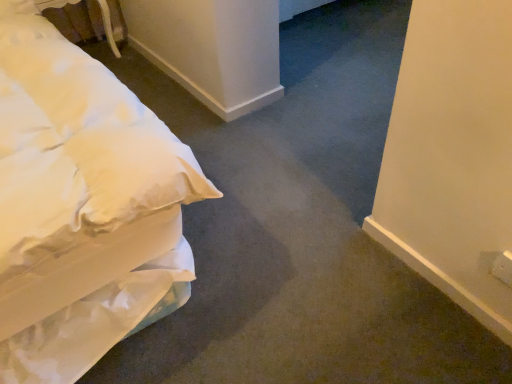
Question: Can you confirm if white fabric bed at upper left is shorter than white soft bed at left?

Choices:
 (A) yes
 (B) no

Answer: (A)

Question: Does white fabric bed at upper left turn towards white soft bed at left?

Choices:
 (A) no
 (B) yes

Answer: (A)

Question: Can you confirm if white fabric bed at upper left is taller than white soft bed at left?

Choices:
 (A) yes
 (B) no

Answer: (B)

Question: Is white fabric bed at upper left smaller than white soft bed at left?

Choices:
 (A) yes
 (B) no

Answer: (A)

Question: Is white soft bed at left at the back of white fabric bed at upper left?

Choices:
 (A) no
 (B) yes

Answer: (A)

Question: Is white fabric bed at upper left directly adjacent to white soft bed at left?

Choices:
 (A) yes
 (B) no

Answer: (B)

Question: Is white fabric bed at upper left inside white soft bed at left?

Choices:
 (A) yes
 (B) no

Answer: (B)

Question: Is white soft bed at left located outside white fabric bed at upper left?

Choices:
 (A) no
 (B) yes

Answer: (B)

Question: Can you confirm if white soft bed at left is taller than white fabric bed at upper left?

Choices:
 (A) no
 (B) yes

Answer: (B)

Question: Does white soft bed at left turn towards white fabric bed at upper left?

Choices:
 (A) yes
 (B) no

Answer: (B)

Question: Is white soft bed at left closer to camera compared to white fabric bed at upper left?

Choices:
 (A) no
 (B) yes

Answer: (B)

Question: Can you confirm if white soft bed at left is wider than white fabric bed at upper left?

Choices:
 (A) no
 (B) yes

Answer: (B)

Question: Considering their positions, is white fabric bed at upper left located in front of or behind white soft bed at left?

Choices:
 (A) behind
 (B) front

Answer: (A)